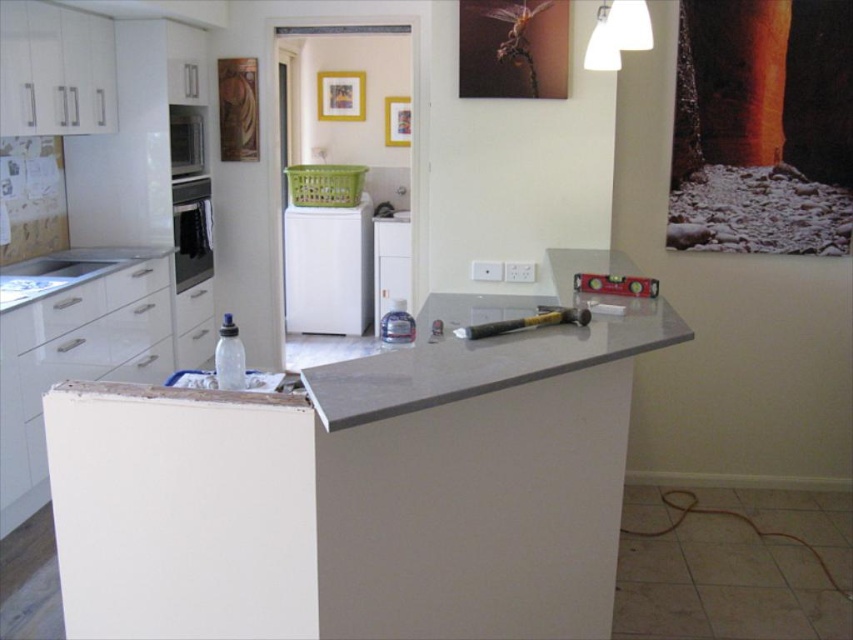
You are a contractor working in the kitchen. You need to move a heavy tool from the satin black oven at left to the white plastic dishwasher at center. Which object will the tool pass over first?

The tool will pass over the satin black oven at left first because it is closer to the viewer than the white plastic dishwasher at center.

You are a contractor working in the kitchen and need to install a new microwave. The microwave requires a mounting space that must be taller than the satin black oven at left but shorter than the white plastic dishwasher at center. Is there a suitable space available between them?

The satin black oven at left has a lesser height compared to the white plastic dishwasher at center. Therefore, the space between them can accommodate a microwave that needs to be taller than the satin black oven at left but shorter than the white plastic dishwasher at center.

You are a renovation worker in the kitchen. You need to place a new microwave on the counter. The microwave must be placed at the point with coordinates point (190, 230). However, the microwave is quite large. Can you place it there without overlapping any existing objects on the counter?

The point (190, 230) is on satin black oven at left, so placing the microwave there would overlap with the oven and thus is not possible.